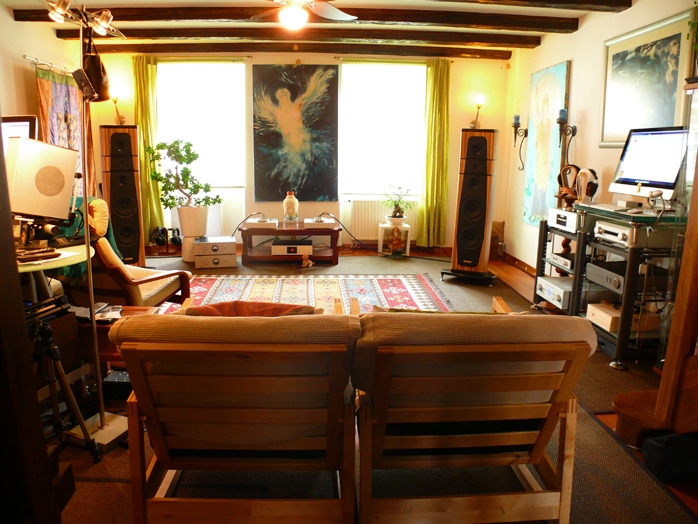
Find the location of `speaker`. speaker is located at coordinates (124, 188), (475, 196).